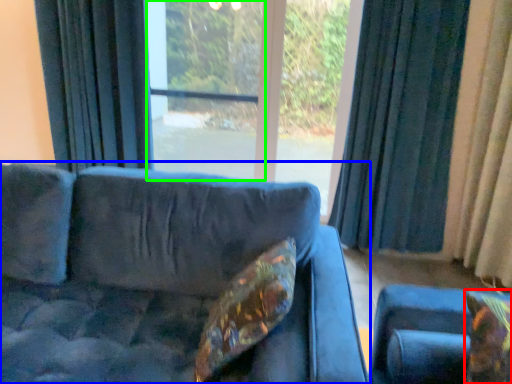
Question: Which object is the closest to the pillow (highlighted by a red box)? Choose among these: studio couch (highlighted by a blue box) or screen door (highlighted by a green box).

Choices:
 (A) studio couch
 (B) screen door

Answer: (A)